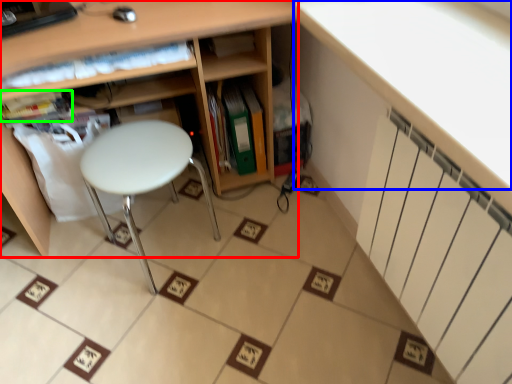
Question: Which is farther away from shelf (highlighted by a red box)? counter top (highlighted by a blue box) or book (highlighted by a green box)?

Choices:
 (A) counter top
 (B) book

Answer: (A)